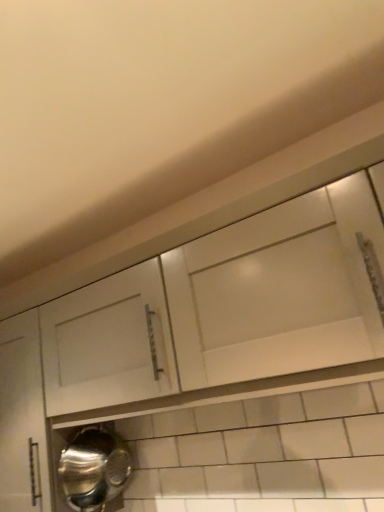
This screenshot has height=512, width=384. What are the coordinates of `shiny metallic water heater at lower left` in the screenshot? It's located at coord(93,468).

Describe the element at coordinates (93, 468) in the screenshot. The image size is (384, 512). I see `shiny metallic water heater at lower left` at that location.

Describe the element at coordinates (215, 362) in the screenshot. I see `white matte cabinet at upper center` at that location.

Where is `white matte cabinet at upper center`? white matte cabinet at upper center is located at coordinates (215, 362).

Identify the location of shiny metallic water heater at lower left. (93, 468).

Does white matte cabinet at upper center appear on the right side of shiny metallic water heater at lower left?

Yes, white matte cabinet at upper center is to the right of shiny metallic water heater at lower left.

Considering the relative positions of white matte cabinet at upper center and shiny metallic water heater at lower left in the image provided, is white matte cabinet at upper center behind shiny metallic water heater at lower left?

No, white matte cabinet at upper center is in front of shiny metallic water heater at lower left.

Considering the positions of points (302, 223) and (114, 439), is point (302, 223) closer to camera compared to point (114, 439)?

Yes, it is in front of point (114, 439).

From the image's perspective, which one is positioned lower, white matte cabinet at upper center or shiny metallic water heater at lower left?

shiny metallic water heater at lower left.

From a real-world perspective, does white matte cabinet at upper center sit lower than shiny metallic water heater at lower left?

No, from a real-world perspective, white matte cabinet at upper center is not beneath shiny metallic water heater at lower left.

Looking at their sizes, would you say white matte cabinet at upper center is wider or thinner than shiny metallic water heater at lower left?

Clearly, white matte cabinet at upper center has more width compared to shiny metallic water heater at lower left.

From their relative heights in the image, would you say white matte cabinet at upper center is taller or shorter than shiny metallic water heater at lower left?

In the image, white matte cabinet at upper center appears to be taller than shiny metallic water heater at lower left.

Which of these two, white matte cabinet at upper center or shiny metallic water heater at lower left, is bigger?

white matte cabinet at upper center.

Is white matte cabinet at upper center located outside shiny metallic water heater at lower left?

Yes, white matte cabinet at upper center is outside of shiny metallic water heater at lower left.

Is white matte cabinet at upper center far away from shiny metallic water heater at lower left?

No, white matte cabinet at upper center is in close proximity to shiny metallic water heater at lower left.

Is white matte cabinet at upper center looking in the opposite direction of shiny metallic water heater at lower left?

No, shiny metallic water heater at lower left is not at the back of white matte cabinet at upper center.

What's the angular difference between white matte cabinet at upper center and shiny metallic water heater at lower left's facing directions?

They differ by 90 degrees in their facing directions.

How distant is white matte cabinet at upper center from shiny metallic water heater at lower left?

white matte cabinet at upper center and shiny metallic water heater at lower left are 35.59 centimeters apart from each other.

The height and width of the screenshot is (512, 384). Identify the location of water heater lying behind the white matte cabinet at upper center. (93, 468).

Between shiny metallic water heater at lower left and white matte cabinet at upper center, which one appears on the left side from the viewer's perspective?

From the viewer's perspective, shiny metallic water heater at lower left appears more on the left side.

Which object is closer to the camera taking this photo, shiny metallic water heater at lower left or white matte cabinet at upper center?

white matte cabinet at upper center is closer to the camera.

Considering the points (69, 461) and (179, 277), which point is behind, point (69, 461) or point (179, 277)?

Point (69, 461)

From the image's perspective, which is above, shiny metallic water heater at lower left or white matte cabinet at upper center?

white matte cabinet at upper center.

From a real-world perspective, is shiny metallic water heater at lower left over white matte cabinet at upper center?

No, from a real-world perspective, shiny metallic water heater at lower left is not over white matte cabinet at upper center

Does shiny metallic water heater at lower left have a greater width compared to white matte cabinet at upper center?

No, shiny metallic water heater at lower left is not wider than white matte cabinet at upper center.

Considering the sizes of shiny metallic water heater at lower left and white matte cabinet at upper center in the image, is shiny metallic water heater at lower left taller or shorter than white matte cabinet at upper center?

Considering their sizes, shiny metallic water heater at lower left has less height than white matte cabinet at upper center.

Which of these two, shiny metallic water heater at lower left or white matte cabinet at upper center, is bigger?

With larger size is white matte cabinet at upper center.

Which is correct: shiny metallic water heater at lower left is inside white matte cabinet at upper center, or outside of it?

shiny metallic water heater at lower left cannot be found inside white matte cabinet at upper center.

Is shiny metallic water heater at lower left next to white matte cabinet at upper center?

shiny metallic water heater at lower left and white matte cabinet at upper center are clearly separated.

Could you tell me if shiny metallic water heater at lower left is turned towards white matte cabinet at upper center?

No, shiny metallic water heater at lower left is not oriented towards white matte cabinet at upper center.

Can you tell me how much shiny metallic water heater at lower left and white matte cabinet at upper center differ in facing direction?

shiny metallic water heater at lower left and white matte cabinet at upper center are facing 90 degrees away from each other.

Identify the location of cabinetry located above the shiny metallic water heater at lower left (from a real-world perspective). (215, 362).

Where is `cabinetry lying above the shiny metallic water heater at lower left (from the image's perspective)`? Image resolution: width=384 pixels, height=512 pixels. cabinetry lying above the shiny metallic water heater at lower left (from the image's perspective) is located at coordinates (215, 362).

This screenshot has height=512, width=384. In order to click on cabinetry above the shiny metallic water heater at lower left (from a real-world perspective) in this screenshot , I will do `click(215, 362)`.